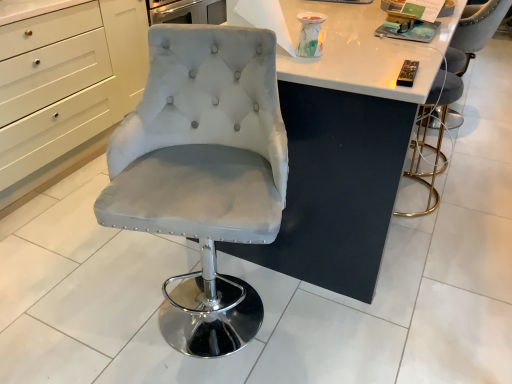
Question: Is black plastic remote control at upper right, the first magazine positioned from the bottom, far from matte gray magazine at upper right, which ranks as the 1th magazine in top-to-bottom order?

Choices:
 (A) no
 (B) yes

Answer: (A)

Question: Is the depth of black plastic remote control at upper right, positioned as the 1th magazine in front-to-back order, greater than that of matte gray magazine at upper right, the first magazine viewed from the back?

Choices:
 (A) yes
 (B) no

Answer: (B)

Question: From a real-world perspective, is black plastic remote control at upper right, positioned as the 1th magazine in front-to-back order, positioned under matte gray magazine at upper right, the first magazine viewed from the back, based on gravity?

Choices:
 (A) no
 (B) yes

Answer: (A)

Question: Does black plastic remote control at upper right, positioned as the 1th magazine in front-to-back order, have a lesser height compared to matte gray magazine at upper right, marked as the second magazine in a front-to-back arrangement?

Choices:
 (A) yes
 (B) no

Answer: (A)

Question: Is black plastic remote control at upper right, arranged as the 2th magazine when viewed from the back, outside of matte gray magazine at upper right, marked as the second magazine in a front-to-back arrangement?

Choices:
 (A) yes
 (B) no

Answer: (A)

Question: Is black plastic remote control at upper right, arranged as the 2th magazine when viewed from the back, wider than matte gray magazine at upper right, positioned as the 2th magazine in bottom-to-top order?

Choices:
 (A) yes
 (B) no

Answer: (B)

Question: Is satin white chair at center, arranged as the first chair when viewed from the front, shorter than velvet grey chair at right, the 3th chair when ordered from front to back?

Choices:
 (A) no
 (B) yes

Answer: (A)

Question: Is satin white chair at center, arranged as the first chair when viewed from the front, bigger than velvet grey chair at right, the 3th chair when ordered from front to back?

Choices:
 (A) yes
 (B) no

Answer: (A)

Question: From the image's perspective, is satin white chair at center, which is counted as the 1th chair, starting from the left, above velvet grey chair at right, which appears as the first chair when viewed from the back?

Choices:
 (A) yes
 (B) no

Answer: (B)

Question: Can you confirm if satin white chair at center, arranged as the 3th chair when viewed from the right, is wider than velvet grey chair at right, which appears as the first chair when viewed from the back?

Choices:
 (A) yes
 (B) no

Answer: (A)

Question: Does satin white chair at center, arranged as the first chair when viewed from the front, turn towards velvet grey chair at right, the 3th chair when ordered from front to back?

Choices:
 (A) yes
 (B) no

Answer: (B)

Question: From a real-world perspective, is satin white chair at center, arranged as the first chair when viewed from the front, over velvet grey chair at right, the 3th chair when ordered from front to back?

Choices:
 (A) yes
 (B) no

Answer: (A)

Question: Does satin white chair at center, arranged as the 3th chair when viewed from the back, have a lesser height compared to black plastic remote control at upper right, the first magazine positioned from the bottom?

Choices:
 (A) no
 (B) yes

Answer: (A)